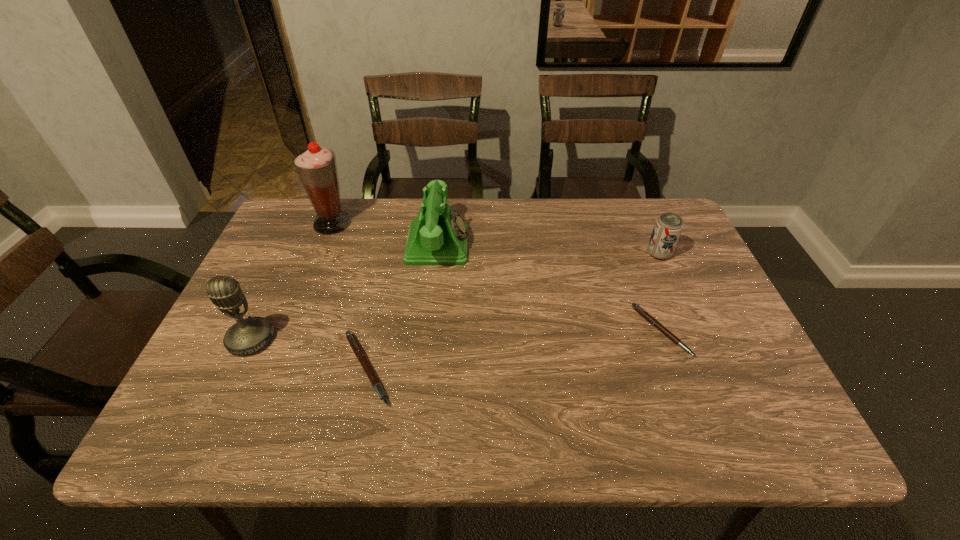
To make them evenly spaced by inserting another pen among them, please locate a free space for this new pen. Please provide its 2D coordinates. Your answer should be formatted as a tuple, i.e. [(x, y)], where the tuple contains the x and y coordinates of a point satisfying the conditions above.

[(519, 349)]